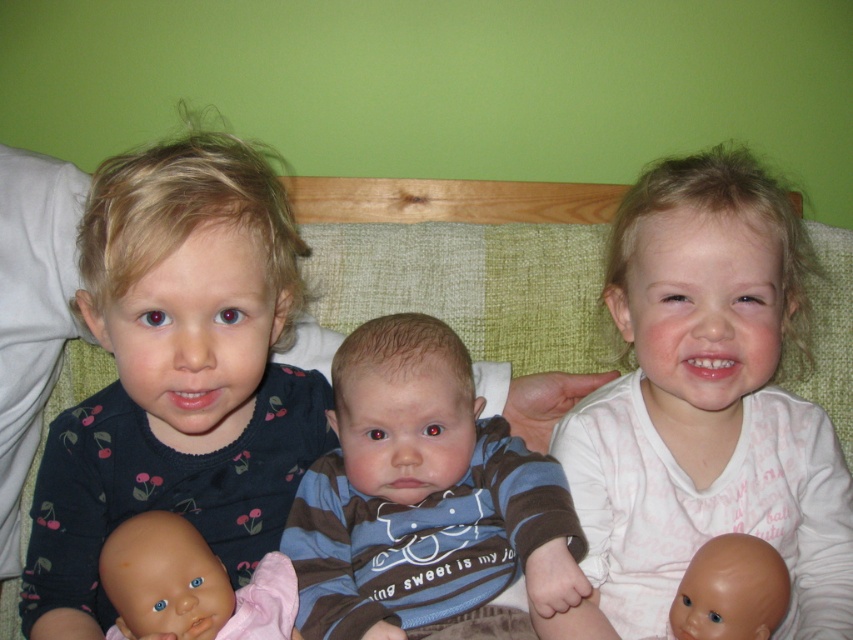
You are a photographer trying to capture a closeup of the child holding the doll with cherry patterns. You are positioned at point A which is closer to the viewer. Which point should you move towards to get a better shot? The points available are point A at coordinates point (212,164) and point B at coordinates point (407,497).

Point A at coordinates point (212,164) is closer to the viewer than point B at coordinates point (407,497), so moving towards point A would allow you to get a closer shot of the child holding the doll with cherry patterns.

Based on the photo, you are a photographer taking a picture of the children. You need to ensure that both the dark blue jersey at left and the striped cotton shirt at center are clearly visible in the frame. Given their sizes, which shirt should you focus on to ensure it doesn

The dark blue jersey at left is wider than the striped cotton shirt at center. Therefore, focusing on the dark blue jersey at left would ensure both shirts are visible since it occupies more space in the frame.